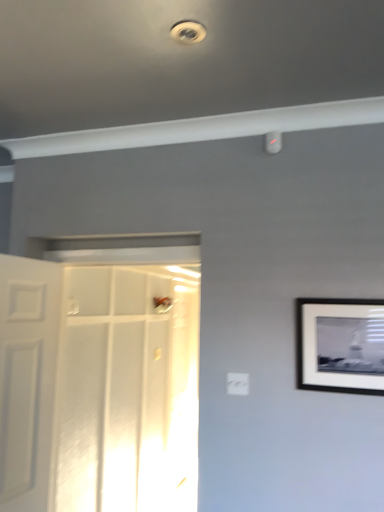
Measure the distance between white plastic droplight at upper right, which appears as the second droplight when viewed from the top, and camera.

white plastic droplight at upper right, which appears as the second droplight when viewed from the top, and camera are 1.75 meters apart.

Describe the element at coordinates (273, 142) in the screenshot. I see `white plastic droplight at upper right, which appears as the second droplight when viewed from the left` at that location.

Measure the distance between white matte door at left, the first door viewed from the left, and camera.

The distance of white matte door at left, the first door viewed from the left, from camera is 5.78 feet.

Measure the distance between point (109,415) and camera.

Point (109,415) is 9.43 feet from camera.

What do you see at coordinates (237, 383) in the screenshot?
I see `white plastic electric outlet at center` at bounding box center [237, 383].

You are a GUI agent. You are given a task and a screenshot of the screen. Output one action in this format:
    pyautogui.click(x=<x>, y=<y>)
    Task: Click on the white plastic droplight at upper right, which appears as the second droplight when viewed from the left
    This screenshot has height=512, width=384.
    Given the screenshot: What is the action you would take?
    pyautogui.click(x=273, y=142)

Who is taller, white matte door at left, which ranks as the second door in right-to-left order, or white plastic droplight at upper center, the first droplight in the left-to-right sequence?

white matte door at left, which ranks as the second door in right-to-left order, is taller.

Can you tell me how much white matte door at left, which ranks as the second door in right-to-left order, and white plastic droplight at upper center, the second droplight in the bottom-to-top sequence, differ in facing direction?

They differ by 81.7 degrees in their facing directions.

Would you consider white matte door at left, which ranks as the second door in right-to-left order, to be distant from white plastic droplight at upper center, the 2th droplight viewed from the back?

Yes, white matte door at left, which ranks as the second door in right-to-left order, and white plastic droplight at upper center, the 2th droplight viewed from the back, are quite far apart.

Is white plastic droplight at upper center, the first droplight in the left-to-right sequence, at the back of white matte door at left, which ranks as the second door in right-to-left order?

No.

Is white plastic droplight at upper center, which is counted as the first droplight, starting from the top, not near white plastic droplight at upper right, placed as the 1th droplight when sorted from back to front?

Actually, white plastic droplight at upper center, which is counted as the first droplight, starting from the top, and white plastic droplight at upper right, placed as the 1th droplight when sorted from back to front, are a little close together.

Where is `droplight positioned vertically above the white plastic droplight at upper right, which appears as the second droplight when viewed from the left (from a real-world perspective)`? The height and width of the screenshot is (512, 384). droplight positioned vertically above the white plastic droplight at upper right, which appears as the second droplight when viewed from the left (from a real-world perspective) is located at coordinates (188, 32).

Considering the relative positions of white plastic droplight at upper center, which is counted as the first droplight, starting from the top, and white plastic droplight at upper right, which appears as the second droplight when viewed from the top, in the image provided, is white plastic droplight at upper center, which is counted as the first droplight, starting from the top, to the left of white plastic droplight at upper right, which appears as the second droplight when viewed from the top, from the viewer's perspective?

Correct, you'll find white plastic droplight at upper center, which is counted as the first droplight, starting from the top, to the left of white plastic droplight at upper right, which appears as the second droplight when viewed from the top.

From a real-world perspective, is white plastic droplight at upper center, which is counted as the first droplight, starting from the top, below white plastic droplight at upper right, the first droplight in the bottom-to-top sequence?

No.

From the image's perspective, which is above, black matte picture frame at right or white plastic electric outlet at center?

black matte picture frame at right is shown above in the image.

Between black matte picture frame at right and white plastic electric outlet at center, which one has larger width?

With larger width is black matte picture frame at right.

In the scene shown: Could you tell me if black matte picture frame at right is turned towards white plastic electric outlet at center?

No, black matte picture frame at right is not facing towards white plastic electric outlet at center.

Relative to white plastic electric outlet at center, is black matte picture frame at right in front or behind?

Clearly, black matte picture frame at right is in front of white plastic electric outlet at center.

Locate an element on the screen. This screenshot has width=384, height=512. picture frame on the right of the white plastic electric outlet at center is located at coordinates (340, 345).

Can you confirm if white plastic electric outlet at center is smaller than black matte picture frame at right?

Yes, white plastic electric outlet at center is smaller than black matte picture frame at right.

Considering the relative sizes of white plastic electric outlet at center and black matte picture frame at right in the image provided, is white plastic electric outlet at center taller than black matte picture frame at right?

In fact, white plastic electric outlet at center may be shorter than black matte picture frame at right.

Can you confirm if white plastic electric outlet at center is wider than black matte picture frame at right?

No.

How many degrees apart are the facing directions of black matte picture frame at right and white plastic droplight at upper right, which appears as the second droplight when viewed from the top?

black matte picture frame at right and white plastic droplight at upper right, which appears as the second droplight when viewed from the top, are facing 0.79 degrees away from each other.

Is black matte picture frame at right to the right of white plastic droplight at upper right, which appears as the second droplight when viewed from the top, from the viewer's perspective?

Yes.

From a real-world perspective, is black matte picture frame at right positioned above or below white plastic droplight at upper right, placed as the 1th droplight when sorted from back to front?

black matte picture frame at right is below white plastic droplight at upper right, placed as the 1th droplight when sorted from back to front.

From the image's perspective, relative to white plastic droplight at upper right, the first droplight in the bottom-to-top sequence, is black matte picture frame at right above or below?

Clearly, from the image's perspective, black matte picture frame at right is below white plastic droplight at upper right, the first droplight in the bottom-to-top sequence.

Find the location of a particular element. The height and width of the screenshot is (512, 384). the 1st droplight above when counting from the white matte door at left, which ranks as the second door in right-to-left order (from the image's perspective) is located at coordinates (273, 142).

Is white plastic droplight at upper right, which appears as the second droplight when viewed from the top, with white matte door at left, which ranks as the second door in right-to-left order?

No, white plastic droplight at upper right, which appears as the second droplight when viewed from the top, is not with white matte door at left, which ranks as the second door in right-to-left order.

Is white plastic droplight at upper right, which appears as the second droplight when viewed from the left, wider than white matte door at left, which ranks as the second door in right-to-left order?

No.

Which of these two, white plastic droplight at upper right, which appears as the second droplight when viewed from the left, or white plastic droplight at upper center, the first droplight in the left-to-right sequence, stands taller?

Standing taller between the two is white plastic droplight at upper right, which appears as the second droplight when viewed from the left.

Who is bigger, white plastic droplight at upper right, which appears as the second droplight when viewed from the left, or white plastic droplight at upper center, the 2th droplight from the right?

white plastic droplight at upper right, which appears as the second droplight when viewed from the left.

Would you say white plastic droplight at upper right, which appears as the second droplight when viewed from the left, contains white plastic droplight at upper center, the second droplight in the bottom-to-top sequence?

No.

Does white plastic droplight at upper right, placed as the 1th droplight when sorted from back to front, appear on the right side of white plastic droplight at upper center, the 2th droplight from the right?

Correct, you'll find white plastic droplight at upper right, placed as the 1th droplight when sorted from back to front, to the right of white plastic droplight at upper center, the 2th droplight from the right.

Identify the location of the 1st droplight to the right of the white matte door at left, which ranks as the second door in right-to-left order, starting your count from the anchor. This screenshot has width=384, height=512. (188, 32).

Locate an element on the screen. droplight below the white plastic droplight at upper center, arranged as the first droplight when viewed from the front (from a real-world perspective) is located at coordinates (273, 142).

Based on their spatial positions, is white plastic electric outlet at center or white matte door at left, which ranks as the second door in right-to-left order, closer to white plastic droplight at upper center, the second droplight in the bottom-to-top sequence?

The object closer to white plastic droplight at upper center, the second droplight in the bottom-to-top sequence, is white plastic electric outlet at center.

Estimate the real-world distances between objects in this image. Which object is further from white plastic droplight at upper center, the second droplight in the bottom-to-top sequence, white plastic electric outlet at center or white glossy door at center, the 1th door viewed from the right?

The object further to white plastic droplight at upper center, the second droplight in the bottom-to-top sequence, is white glossy door at center, the 1th door viewed from the right.

Which object lies nearer to the anchor point white plastic droplight at upper right, the first droplight in the bottom-to-top sequence, white plastic electric outlet at center or white glossy door at center, the second door positioned from the left?

The object closer to white plastic droplight at upper right, the first droplight in the bottom-to-top sequence, is white plastic electric outlet at center.

Estimate the real-world distances between objects in this image. Which object is closer to white matte door at left, the first door viewed from the left, white plastic droplight at upper center, the 2th droplight viewed from the back, or white plastic droplight at upper right, which appears as the second droplight when viewed from the left?

white plastic droplight at upper right, which appears as the second droplight when viewed from the left, is positioned closer to the anchor white matte door at left, the first door viewed from the left.

Estimate the real-world distances between objects in this image. Which object is closer to white plastic droplight at upper right, placed as the 1th droplight when sorted from back to front, white plastic droplight at upper center, which is counted as the first droplight, starting from the top, or black matte picture frame at right?

white plastic droplight at upper center, which is counted as the first droplight, starting from the top, is closer to white plastic droplight at upper right, placed as the 1th droplight when sorted from back to front.

From the image, which object appears to be farther from black matte picture frame at right, white glossy door at center, the 1th door viewed from the right, or white plastic droplight at upper right, the second droplight positioned from the front?

white glossy door at center, the 1th door viewed from the right, is positioned further to the anchor black matte picture frame at right.

Consider the image. Which object lies nearer to the anchor point white plastic droplight at upper center, which is counted as the first droplight, starting from the top, white plastic droplight at upper right, placed as the 1th droplight when sorted from back to front, or white glossy door at center, the 1th door viewed from the right?

white plastic droplight at upper right, placed as the 1th droplight when sorted from back to front, lies closer to white plastic droplight at upper center, which is counted as the first droplight, starting from the top, than the other object.

Considering their positions, is white plastic droplight at upper center, the 2th droplight from the right, positioned further to white plastic droplight at upper right, the second droplight positioned from the front, than white matte door at left, the first door viewed from the left?

white matte door at left, the first door viewed from the left, is positioned further to the anchor white plastic droplight at upper right, the second droplight positioned from the front.

Locate an element on the screen. Image resolution: width=384 pixels, height=512 pixels. electric outlet between white matte door at left, the first door viewed from the left, and black matte picture frame at right is located at coordinates (237, 383).

I want to click on picture frame that lies between white plastic droplight at upper right, the 1th droplight viewed from the right, and white glossy door at center, the second door positioned from the left, from top to bottom, so click(x=340, y=345).

I want to click on electric outlet between white plastic droplight at upper center, the second droplight in the bottom-to-top sequence, and white glossy door at center, the second door positioned from the left, in the up-down direction, so click(237, 383).

Find the location of a particular element. This screenshot has height=512, width=384. door between white matte door at left, which ranks as the second door in right-to-left order, and white plastic electric outlet at center is located at coordinates pyautogui.click(x=100, y=374).